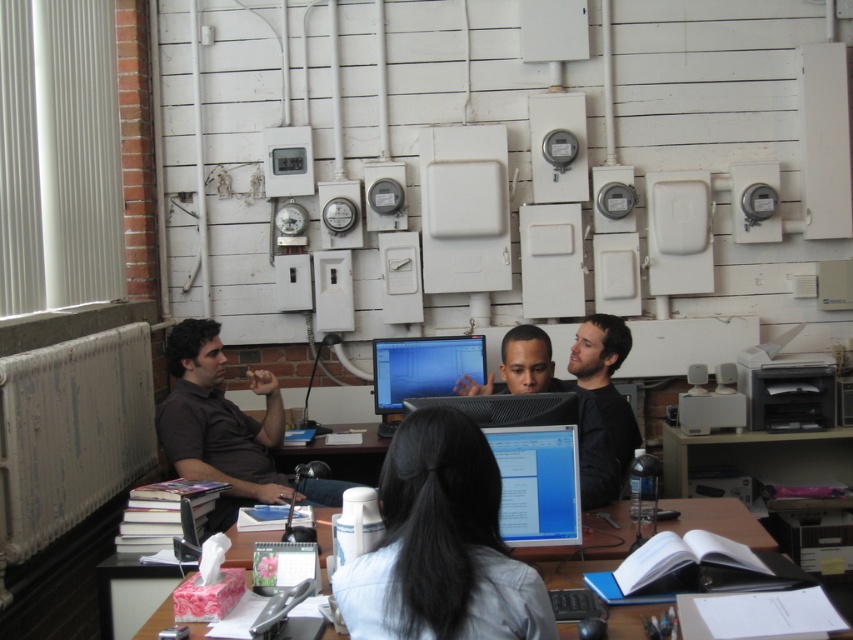
Question: Which of the following is the closest to the observer?

Choices:
 (A) matte brown shirt at left
 (B) black glossy laptop at center

Answer: (B)

Question: Is light blue shirt at center bigger than wooden desk at center?

Choices:
 (A) yes
 (B) no

Answer: (B)

Question: Among these points, which one is farthest from the camera?

Choices:
 (A) (846, 634)
 (B) (490, 412)

Answer: (B)

Question: Which object appears farthest from the camera in this image?

Choices:
 (A) matte black monitor at center
 (B) matte brown shirt at left
 (C) light blue shirt at center
 (D) wooden desk at center

Answer: (A)

Question: Can you confirm if matte brown shirt at left is positioned below black matte computer monitor at center?

Choices:
 (A) no
 (B) yes

Answer: (B)

Question: Can you confirm if light blue shirt at center is smaller than wooden desk at center?

Choices:
 (A) yes
 (B) no

Answer: (A)